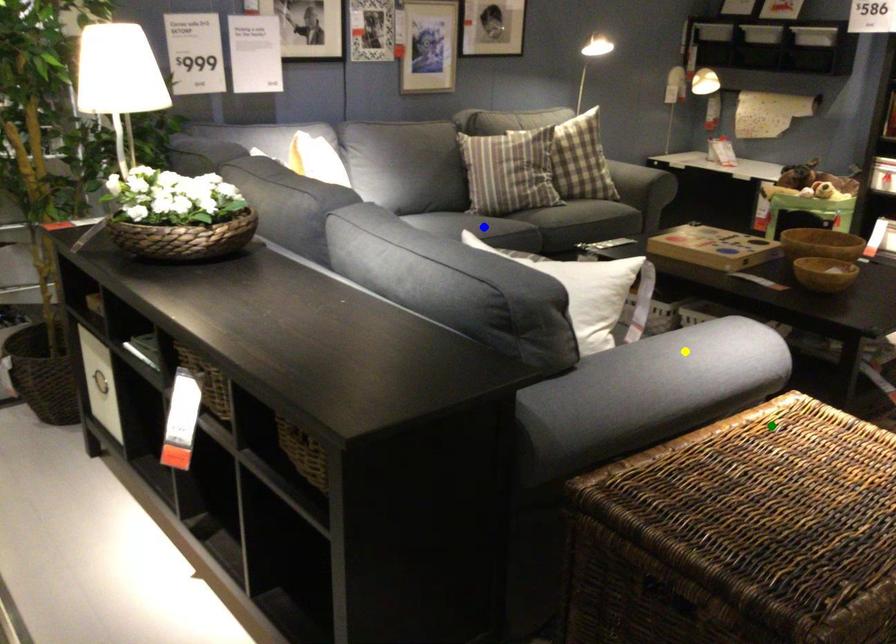
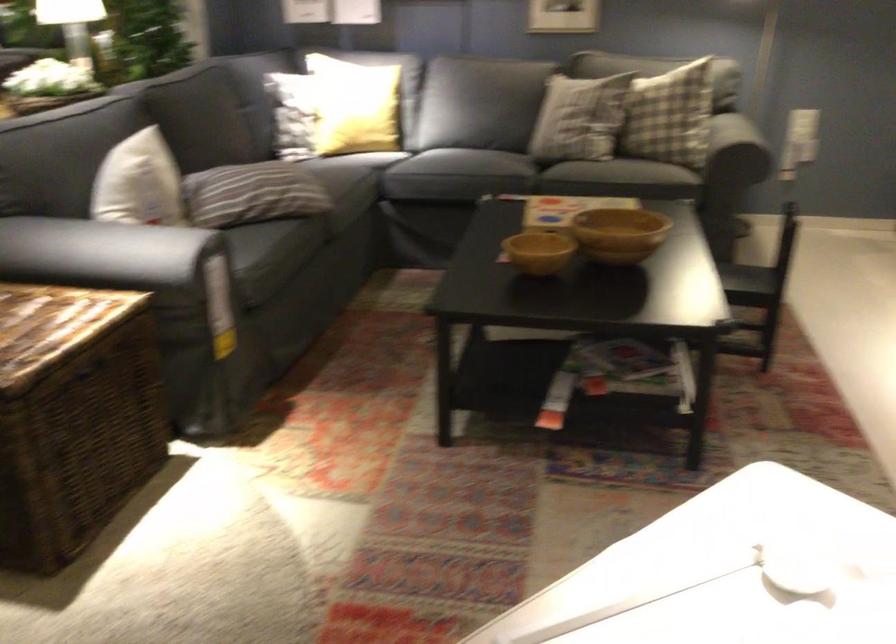
I am providing you with two images of the same scene from different viewpoints. Three points are marked in image1. Which point corresponds to a part or object that is occluded in image2?In image1, three points are marked. Which of them correspond to a part or object that is occluded in image2?Among the three points shown in image1, which one corresponds to a part or object that is no longer visible due to occlusion in image2?

blue point